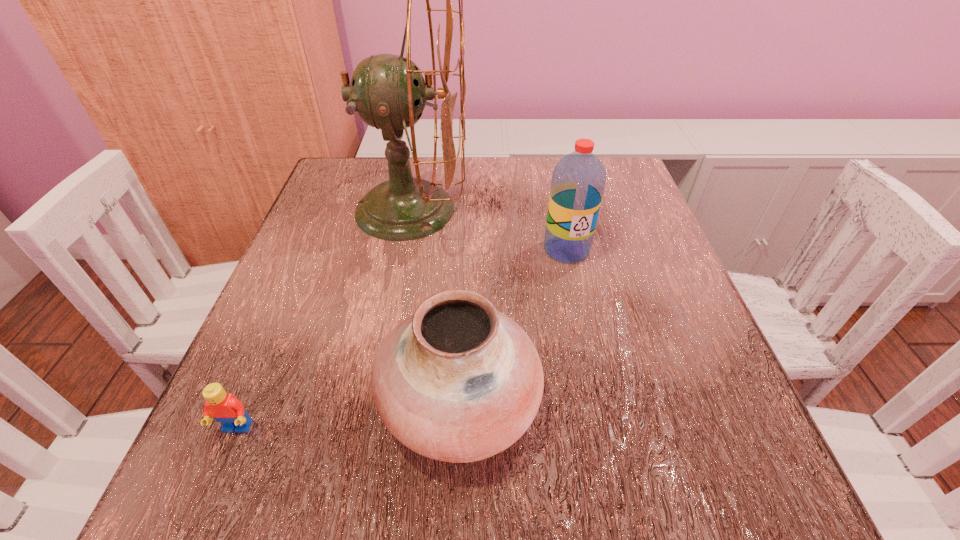
This screenshot has height=540, width=960. What are the coordinates of `object located in the far edge section of the desktop` in the screenshot? It's located at (388, 92).

In order to click on object that is at the near edge in this screenshot , I will do `click(457, 381)`.

The width and height of the screenshot is (960, 540). I want to click on fan at the left edge, so click(x=388, y=92).

Locate an element on the screen. Lego present at the left edge is located at coordinates (223, 407).

Identify the location of object that is at the right edge. The height and width of the screenshot is (540, 960). (578, 181).

The width and height of the screenshot is (960, 540). Identify the location of object located at the far left corner. (388, 92).

Locate an element on the screen. The height and width of the screenshot is (540, 960). free location at the far edge is located at coordinates (474, 200).

Locate an element on the screen. The image size is (960, 540). vacant area at the near edge is located at coordinates (472, 464).

This screenshot has height=540, width=960. Identify the location of vacant space at the left edge of the desktop. (257, 321).

Find the location of a particular element. vacant space at the right edge is located at coordinates (619, 297).